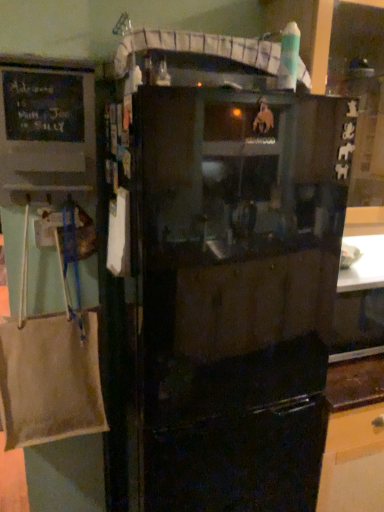
Question: Should I look upward or downward to see chalkboard matte black at left?

Choices:
 (A) down
 (B) up

Answer: (B)

Question: Considering the relative sizes of chalkboard matte black at left and black matte refrigerator at center in the image provided, is chalkboard matte black at left bigger than black matte refrigerator at center?

Choices:
 (A) yes
 (B) no

Answer: (B)

Question: Is black matte refrigerator at center inside chalkboard matte black at left?

Choices:
 (A) no
 (B) yes

Answer: (A)

Question: Is chalkboard matte black at left far from black matte refrigerator at center?

Choices:
 (A) no
 (B) yes

Answer: (A)

Question: Is chalkboard matte black at left to the right of black matte refrigerator at center from the viewer's perspective?

Choices:
 (A) no
 (B) yes

Answer: (A)

Question: From a real-world perspective, is chalkboard matte black at left beneath black matte refrigerator at center?

Choices:
 (A) yes
 (B) no

Answer: (B)

Question: Does chalkboard matte black at left have a greater width compared to black matte refrigerator at center?

Choices:
 (A) yes
 (B) no

Answer: (B)

Question: Is black matte refrigerator at center turned away from chalkboard matte black at left?

Choices:
 (A) yes
 (B) no

Answer: (B)

Question: From a real-world perspective, does black matte refrigerator at center stand above chalkboard matte black at left?

Choices:
 (A) no
 (B) yes

Answer: (A)

Question: Does black matte refrigerator at center appear on the right side of chalkboard matte black at left?

Choices:
 (A) yes
 (B) no

Answer: (A)

Question: From the image's perspective, is black matte refrigerator at center over chalkboard matte black at left?

Choices:
 (A) no
 (B) yes

Answer: (A)

Question: Considering the relative sizes of black matte refrigerator at center and chalkboard matte black at left in the image provided, is black matte refrigerator at center thinner than chalkboard matte black at left?

Choices:
 (A) no
 (B) yes

Answer: (A)

Question: From the image's perspective, is black matte refrigerator at center located beneath chalkboard matte black at left?

Choices:
 (A) yes
 (B) no

Answer: (A)

Question: From a real-world perspective, is chalkboard matte black at left physically located above or below black matte refrigerator at center?

Choices:
 (A) above
 (B) below

Answer: (A)